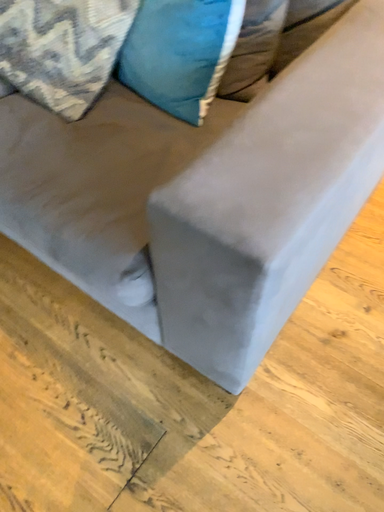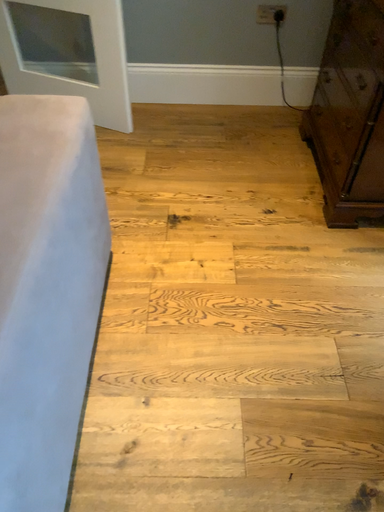
Question: Which way did the camera rotate in the video?

Choices:
 (A) rotated right
 (B) rotated left

Answer: (A)